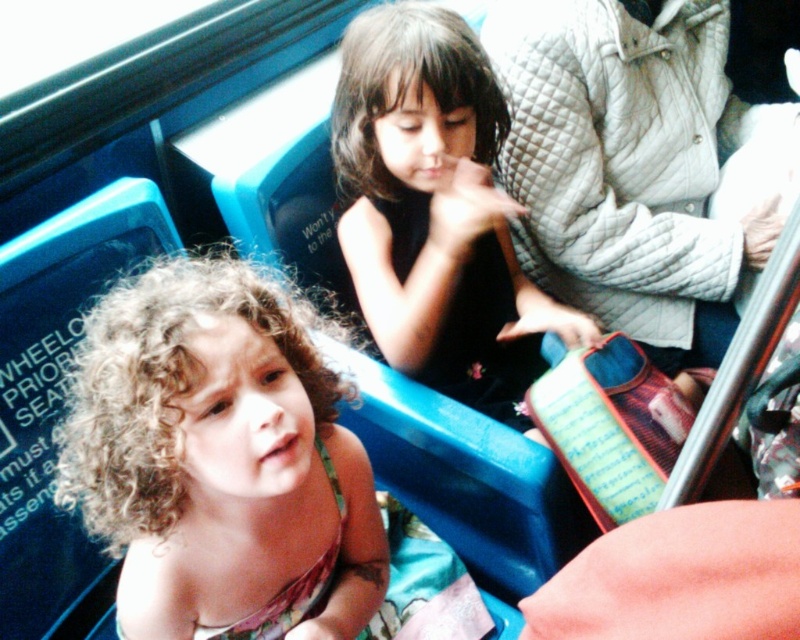
Who is shorter, curly hair at center or black matte dress at center?

curly hair at center is shorter.

In the scene shown: Does curly hair at center have a lesser height compared to black matte dress at center?

Correct, curly hair at center is not as tall as black matte dress at center.

Which is in front, point (124, 564) or point (341, 120)?

Point (124, 564) is in front.

What are the coordinates of `curly hair at center` in the screenshot? It's located at (216, 454).

Is white quilted jacket at upper right above black matte dress at center?

Indeed, white quilted jacket at upper right is positioned over black matte dress at center.

Which is behind, point (676, 296) or point (476, 321)?

The point (676, 296) is more distant.

Which is behind, point (770, 172) or point (486, 168)?

The point (770, 172) is more distant.

Identify the location of white quilted jacket at upper right. The width and height of the screenshot is (800, 640). (640, 164).

Does curly hair at center have a larger size compared to white quilted jacket at upper right?

No.

Who is higher up, curly hair at center or white quilted jacket at upper right?

white quilted jacket at upper right

This screenshot has height=640, width=800. In order to click on curly hair at center in this screenshot , I will do `click(216, 454)`.

Identify the location of curly hair at center. (216, 454).